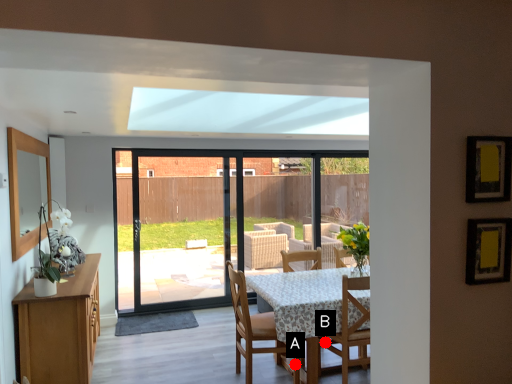
Question: Two points are circled on the image, labeled by A and B beside each circle. Which point is closer to the camera taking this photo?

Choices:
 (A) A is closer
 (B) B is closer

Answer: (B)